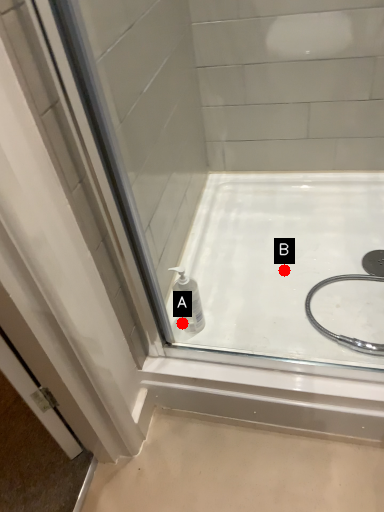
Question: Two points are circled on the image, labeled by A and B beside each circle. Which point appears closest to the camera in this image?

Choices:
 (A) A is closer
 (B) B is closer

Answer: (A)